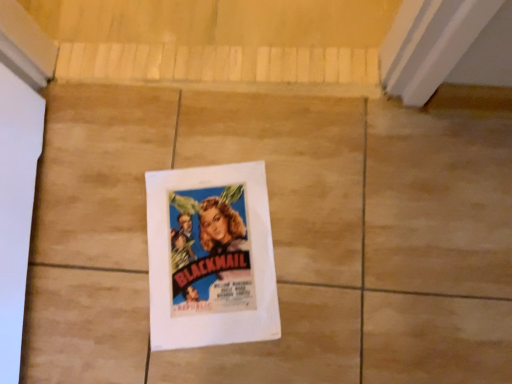
Where is `matte paper poster at center`? This screenshot has height=384, width=512. matte paper poster at center is located at coordinates (210, 257).

The width and height of the screenshot is (512, 384). What do you see at coordinates (210, 257) in the screenshot?
I see `matte paper poster at center` at bounding box center [210, 257].

The image size is (512, 384). What are the coordinates of `matte paper poster at center` in the screenshot? It's located at (210, 257).